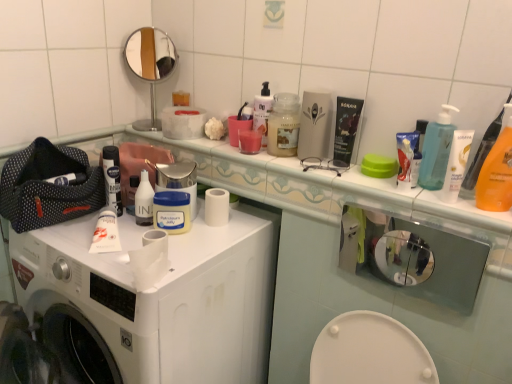
Question: Is metallic silver glasses at upper center a part of white matte washing machine at center?

Choices:
 (A) yes
 (B) no

Answer: (B)

Question: From a real-world perspective, is white matte washing machine at center on top of metallic silver glasses at upper center?

Choices:
 (A) no
 (B) yes

Answer: (A)

Question: Considering the relative sizes of white matte washing machine at center and metallic silver glasses at upper center in the image provided, is white matte washing machine at center smaller than metallic silver glasses at upper center?

Choices:
 (A) no
 (B) yes

Answer: (A)

Question: Does white matte washing machine at center have a greater height compared to metallic silver glasses at upper center?

Choices:
 (A) yes
 (B) no

Answer: (A)

Question: Is white matte washing machine at center closer to camera compared to metallic silver glasses at upper center?

Choices:
 (A) no
 (B) yes

Answer: (B)

Question: Would you say translucent plastic cup at center, which ranks as the third mouthwash in left-to-right order, is inside or outside white matte washing machine at center?

Choices:
 (A) outside
 (B) inside

Answer: (A)

Question: Is translucent plastic cup at center, acting as the 2th mouthwash starting from the right, taller or shorter than white matte washing machine at center?

Choices:
 (A) short
 (B) tall

Answer: (A)

Question: Considering their positions, is translucent plastic cup at center, which ranks as the third mouthwash in left-to-right order, located in front of or behind white matte washing machine at center?

Choices:
 (A) behind
 (B) front

Answer: (A)

Question: In terms of size, does translucent plastic cup at center, acting as the 2th mouthwash starting from the right, appear bigger or smaller than white matte washing machine at center?

Choices:
 (A) big
 (B) small

Answer: (B)

Question: Is white matte washing machine at center in front of or behind white matte tube at center in the image?

Choices:
 (A) behind
 (B) front

Answer: (B)

Question: Considering the positions of white matte washing machine at center and white matte tube at center in the image, is white matte washing machine at center bigger or smaller than white matte tube at center?

Choices:
 (A) small
 (B) big

Answer: (B)

Question: Is white matte washing machine at center wider or thinner than white matte tube at center?

Choices:
 (A) thin
 (B) wide

Answer: (B)

Question: Choose the correct answer: Is white matte washing machine at center inside white matte tube at center or outside it?

Choices:
 (A) inside
 (B) outside

Answer: (B)

Question: In terms of width, does white matte tube at center look wider or thinner when compared to white glossy lotion at upper right, acting as the second toiletry starting from the back?

Choices:
 (A) thin
 (B) wide

Answer: (B)

Question: From a real-world perspective, relative to white glossy lotion at upper right, acting as the second toiletry starting from the back, is white matte tube at center vertically above or below?

Choices:
 (A) above
 (B) below

Answer: (B)